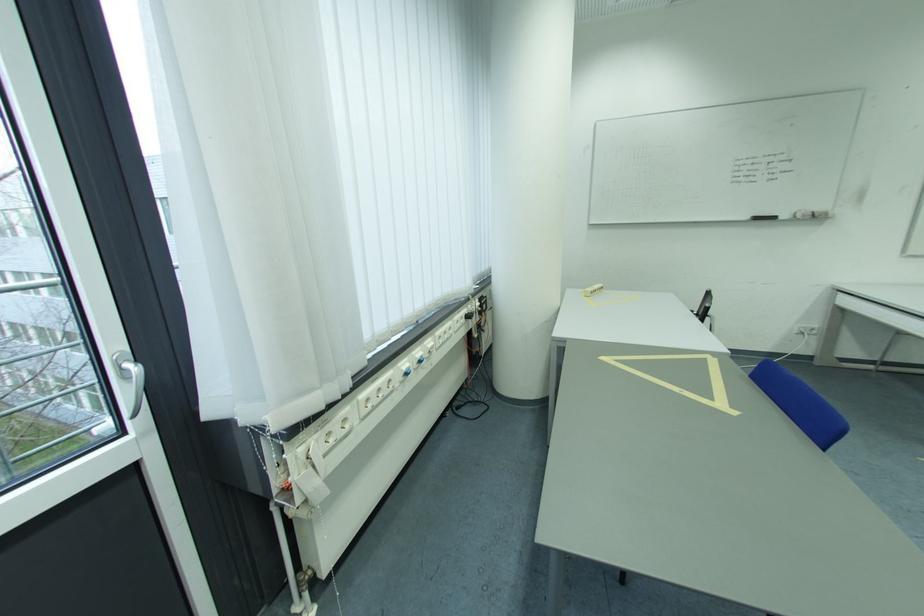
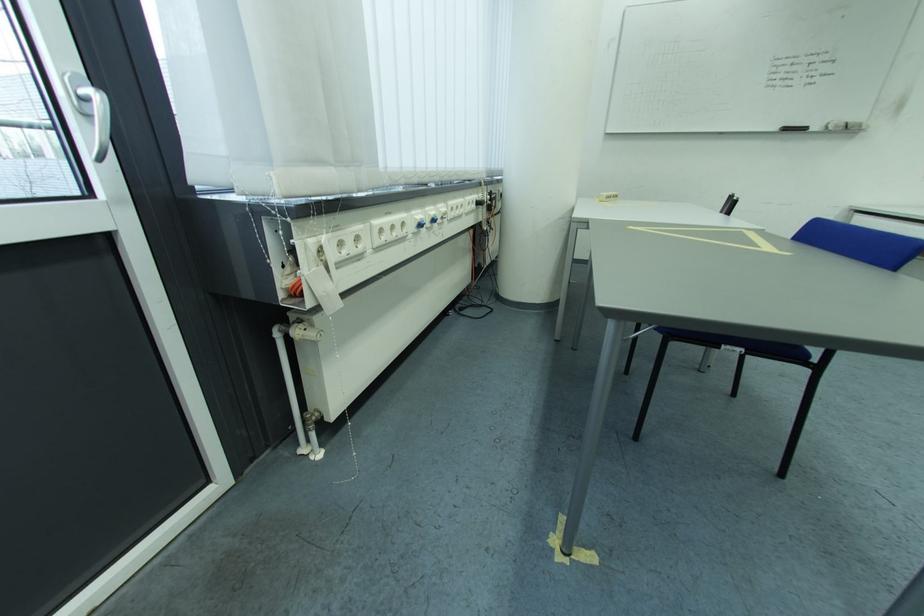
In the second image, find the point that corresponds to the point at 419,371 in the first image.

(433, 224)